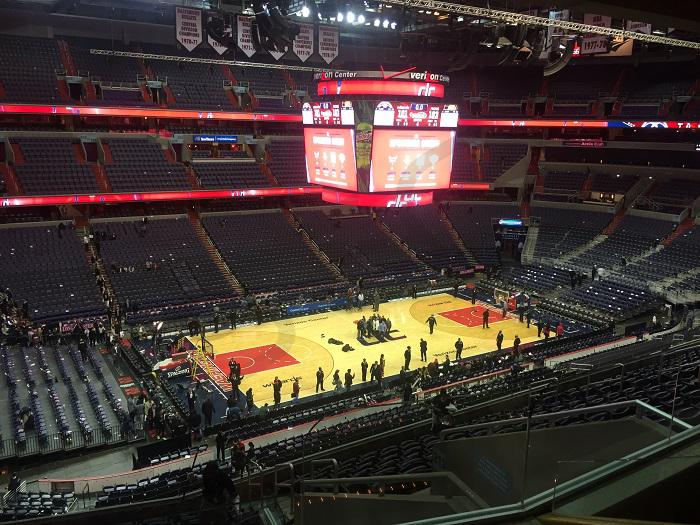
Locate an element on the screen. The height and width of the screenshot is (525, 700). stairs is located at coordinates (384, 510), (589, 426).